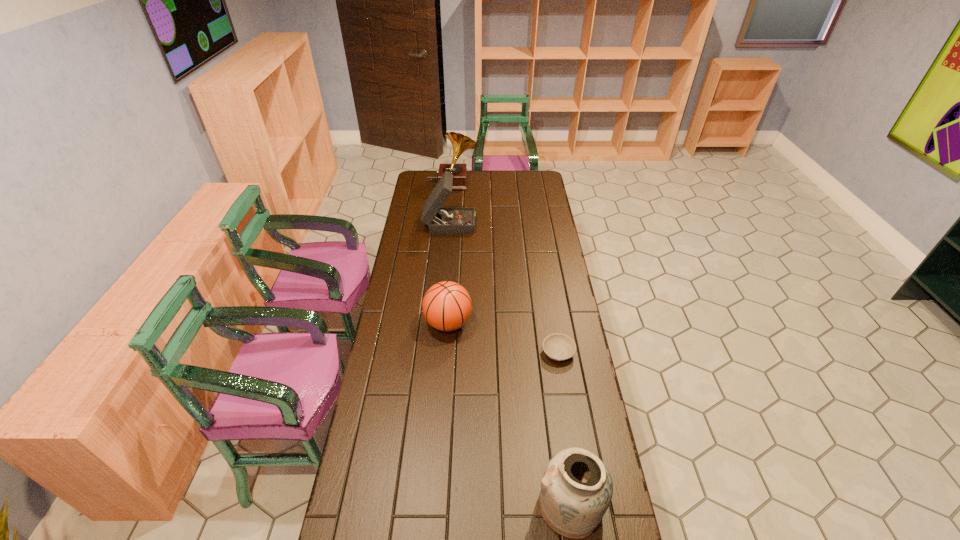
The width and height of the screenshot is (960, 540). In order to click on the taller phonograph_record in this screenshot , I will do `click(460, 143)`.

Locate an element on the screen. This screenshot has height=540, width=960. the farthest object is located at coordinates (460, 143).

At what (x,y) coordinates should I click in order to perform the action: click on the nearer phonograph_record. Please return your answer as a coordinate pair (x, y). This screenshot has height=540, width=960. Looking at the image, I should click on (440, 220).

Image resolution: width=960 pixels, height=540 pixels. What are the coordinates of `the shorter phonograph_record` in the screenshot? It's located at (440, 220).

Image resolution: width=960 pixels, height=540 pixels. I want to click on basketball, so click(447, 306).

Where is `the shortest object`? The image size is (960, 540). the shortest object is located at coordinates (557, 346).

Locate an element on the screen. vacant space located from the horn of the tallest object is located at coordinates (516, 184).

Find the location of `vacant area situated on the front-facing side of the nearer phonograph_record`. vacant area situated on the front-facing side of the nearer phonograph_record is located at coordinates (512, 222).

Identify the location of free space located on the front of the basketball. The image size is (960, 540). (445, 357).

At what (x,y) coordinates should I click in order to perform the action: click on vacant space located on the left of the shortest object. Please return your answer as a coordinate pair (x, y). This screenshot has width=960, height=540. Looking at the image, I should click on (474, 353).